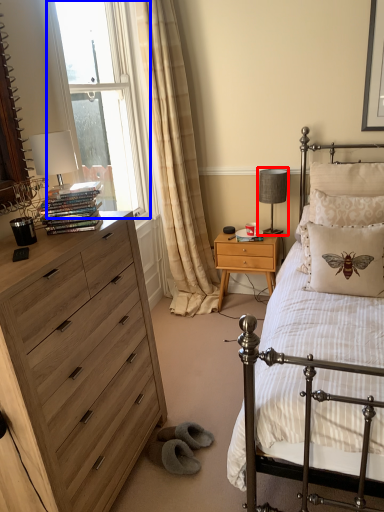
Question: Which object is further to the camera taking this photo, table lamp (highlighted by a red box) or window (highlighted by a blue box)?

Choices:
 (A) table lamp
 (B) window

Answer: (A)